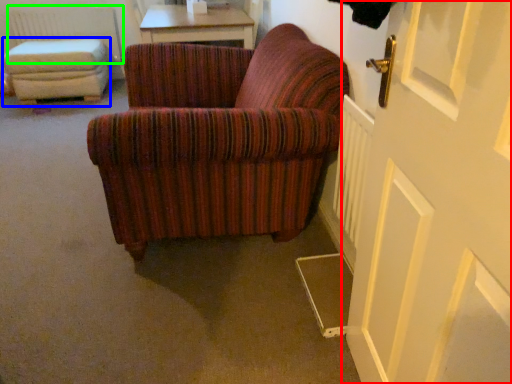
Question: Based on their relative distances, which object is nearer to door (highlighted by a red box)? Choose from stool (highlighted by a blue box) and radiator (highlighted by a green box).

Choices:
 (A) stool
 (B) radiator

Answer: (A)